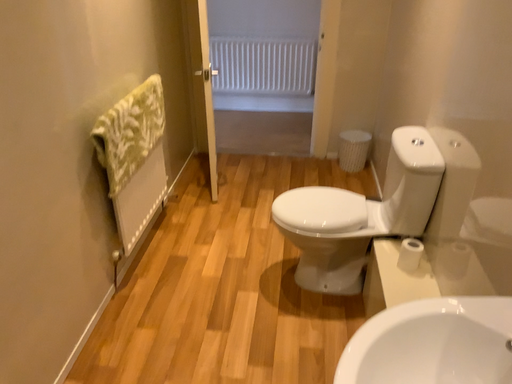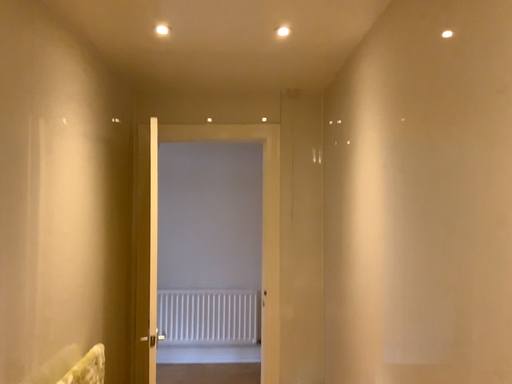
Question: Which way did the camera rotate in the video?

Choices:
 (A) rotated right
 (B) rotated left

Answer: (A)